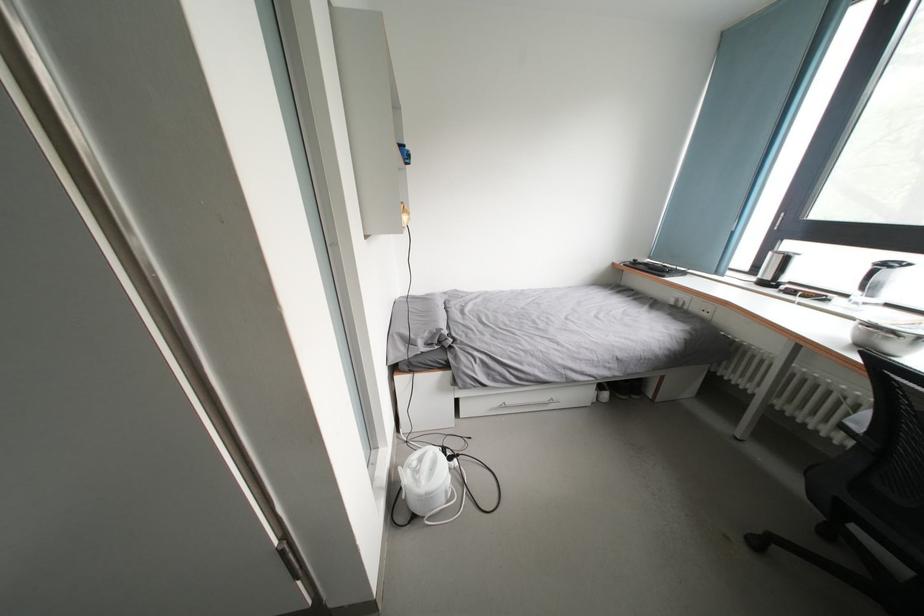
What do you see at coordinates (529, 405) in the screenshot? This screenshot has width=924, height=616. I see `the white drawer handle` at bounding box center [529, 405].